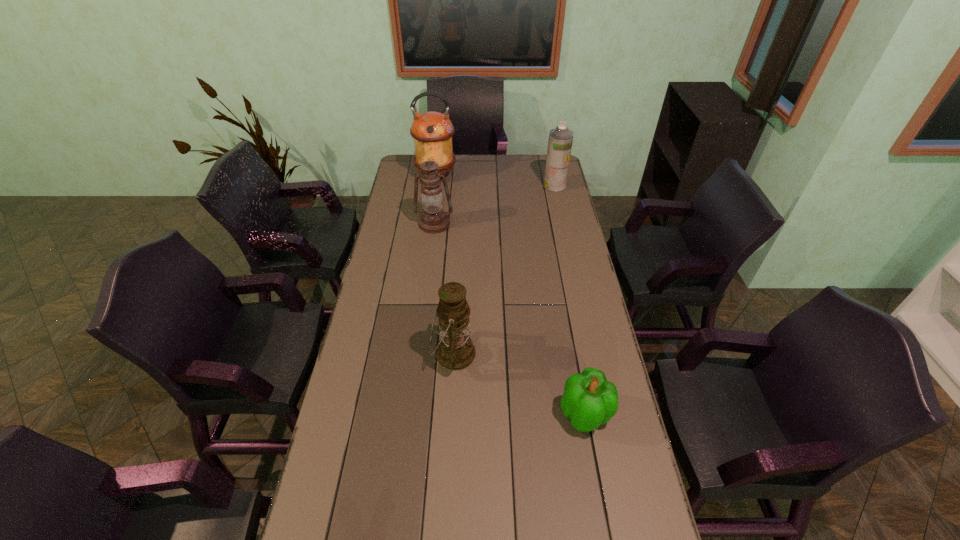
Where is `vacant space that satisfies the following two spatial constraints: 1. on the front side of the bell pepper; 2. on the right side of the second farthest oil lamp`? The height and width of the screenshot is (540, 960). vacant space that satisfies the following two spatial constraints: 1. on the front side of the bell pepper; 2. on the right side of the second farthest oil lamp is located at coordinates (411, 414).

What are the coordinates of `vacant space that satisfies the following two spatial constraints: 1. on the front side of the nearest oil lamp; 2. on the right side of the nearest object` in the screenshot? It's located at (450, 414).